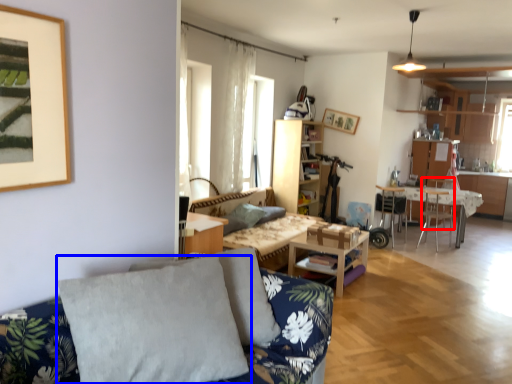
Question: Which object is closer to the camera taking this photo, armchair (highlighted by a red box) or pillow (highlighted by a blue box)?

Choices:
 (A) armchair
 (B) pillow

Answer: (B)